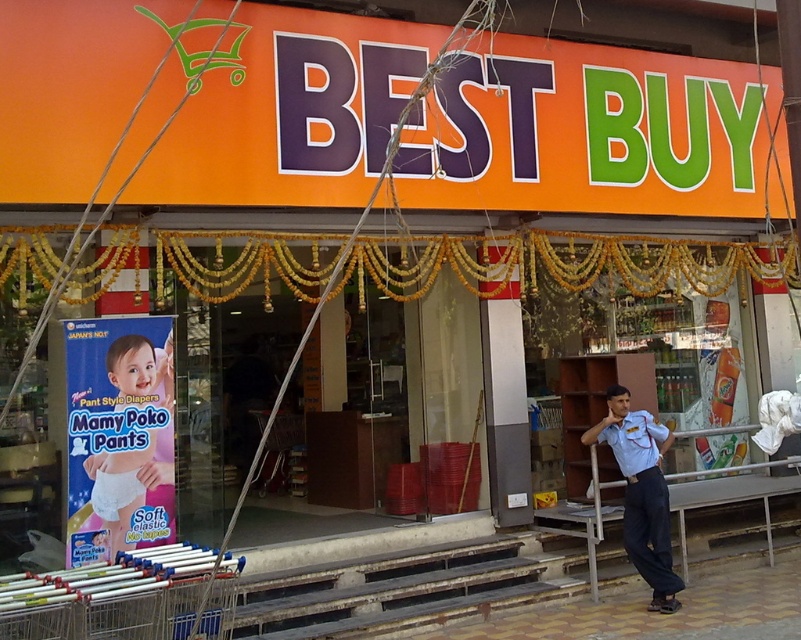
In the scene shown: Is light blue uniform at center behind soft plastic diaper at lower left?

Yes, light blue uniform at center is behind soft plastic diaper at lower left.

Measure the distance between light blue uniform at center and camera.

light blue uniform at center and camera are 6.97 meters apart.

Locate an element on the screen. light blue uniform at center is located at coordinates (641, 492).